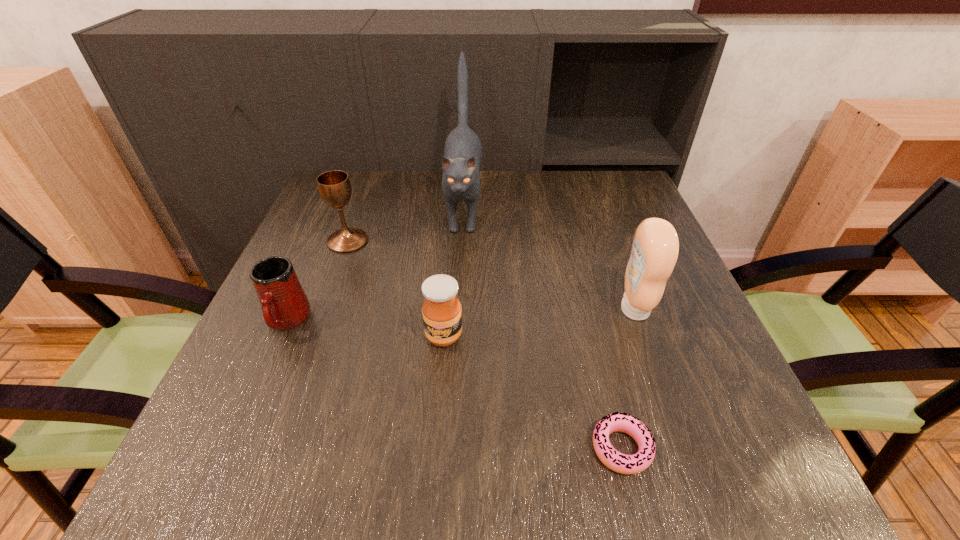
This screenshot has height=540, width=960. I want to click on object that is positioned at the right edge, so click(655, 248).

Find the location of `free space at the far edge of the desktop`. free space at the far edge of the desktop is located at coordinates (533, 188).

Where is `vacant space at the near edge of the desktop`? vacant space at the near edge of the desktop is located at coordinates (500, 476).

Find the location of `vacant space at the left edge`. vacant space at the left edge is located at coordinates (311, 262).

Identify the location of vacant space at the right edge. Image resolution: width=960 pixels, height=540 pixels. (683, 305).

Locate an element on the screen. This screenshot has width=960, height=540. vacant area at the far left corner of the desktop is located at coordinates (320, 198).

The height and width of the screenshot is (540, 960). What are the coordinates of `free space at the far right corner of the desktop` in the screenshot? It's located at 613,214.

The image size is (960, 540). In the image, there is a desktop. What are the coordinates of `free region at the near right corner` in the screenshot? It's located at (763, 484).

Identify the location of free spot between the rightmost object and the honey. The image size is (960, 540). (540, 323).

This screenshot has width=960, height=540. I want to click on vacant area that lies between the fifth object from left to right and the tallest object, so click(542, 328).